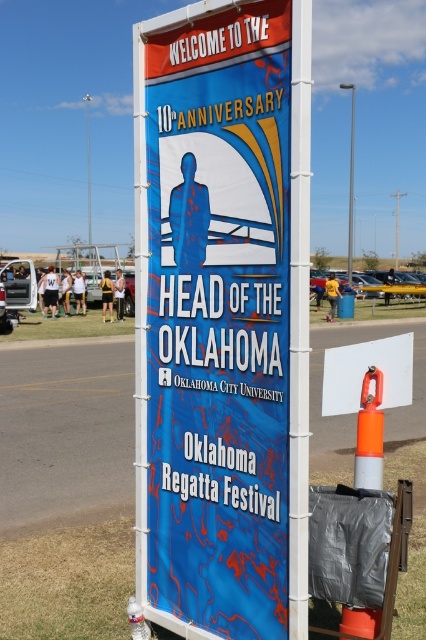
Consider the image. Does blue vinyl banner at center have a lesser height compared to metallic pole at center?

Indeed, blue vinyl banner at center has a lesser height compared to metallic pole at center.

Who is more forward, (155, 493) or (348, 253)?

Point (155, 493) is more forward.

What are the coordinates of `blue vinyl banner at center` in the screenshot? It's located at (218, 321).

Who is shorter, orange reflective traffic cone at lower right or white plastic pole at upper center?

Standing shorter between the two is orange reflective traffic cone at lower right.

The image size is (426, 640). In order to click on orange reflective traffic cone at lower right in this screenshot , I will do `click(370, 433)`.

Can you confirm if orange reflective traffic cone at lower right is shorter than metallic pole at center?

Yes, orange reflective traffic cone at lower right is shorter than metallic pole at center.

Is orange reflective traffic cone at lower right closer to the viewer compared to metallic pole at center?

Yes, orange reflective traffic cone at lower right is closer to the viewer.

Which is in front, point (373, 372) or point (351, 168)?

Point (373, 372) is more forward.

I want to click on orange reflective traffic cone at lower right, so pyautogui.click(x=370, y=433).